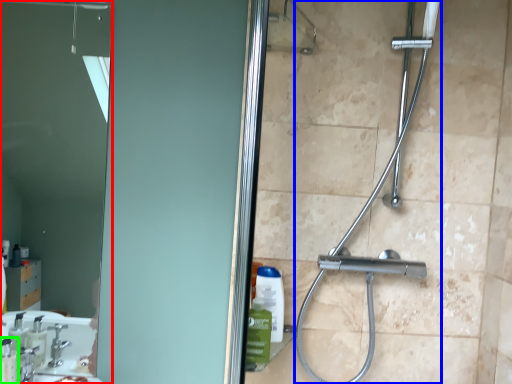
Question: Which is farther away from mirror (highlighted by a red box)? shower (highlighted by a blue box) or soap dispenser (highlighted by a green box)?

Choices:
 (A) shower
 (B) soap dispenser

Answer: (A)